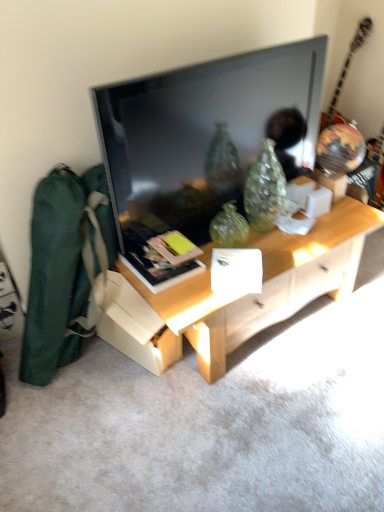
You are a GUI agent. You are given a task and a screenshot of the screen. Output one action in this format:
    pyautogui.click(x=<x>, y=<y>)
    Task: Click on the free space on the front side of matte black book at center
    
    Given the screenshot: What is the action you would take?
    pyautogui.click(x=187, y=297)